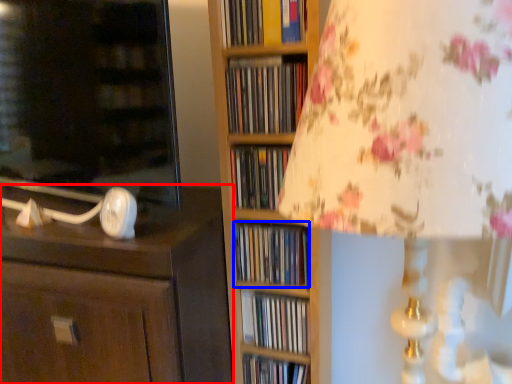
Question: Among these objects, which one is nearest to the camera, chest of drawers (highlighted by a red box) or book (highlighted by a blue box)?

Choices:
 (A) chest of drawers
 (B) book

Answer: (A)